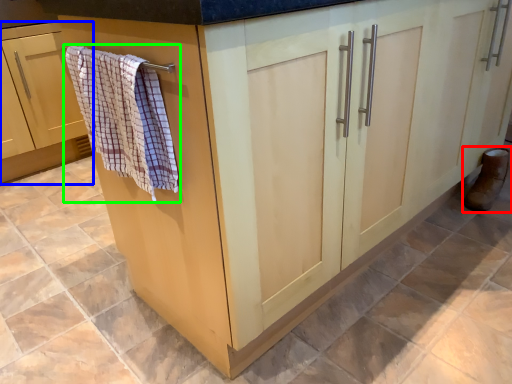
Question: Which is farther away from footwear (highlighted by a red box)? cabinetry (highlighted by a blue box) or bath towel (highlighted by a green box)?

Choices:
 (A) cabinetry
 (B) bath towel

Answer: (A)